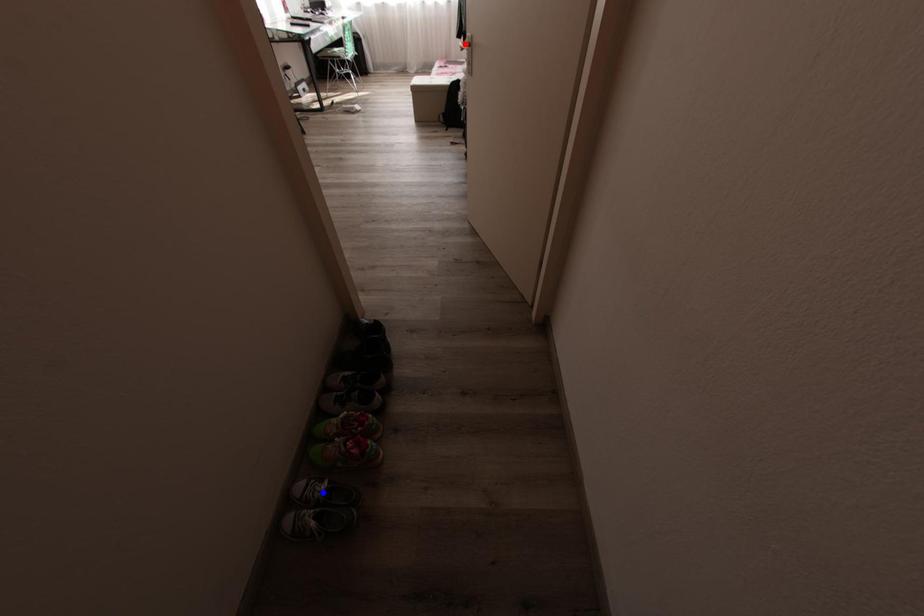
Question: Which of the two points in the image is closer to the camera?

Choices:
 (A) Blue point is closer.
 (B) Red point is closer.

Answer: (A)